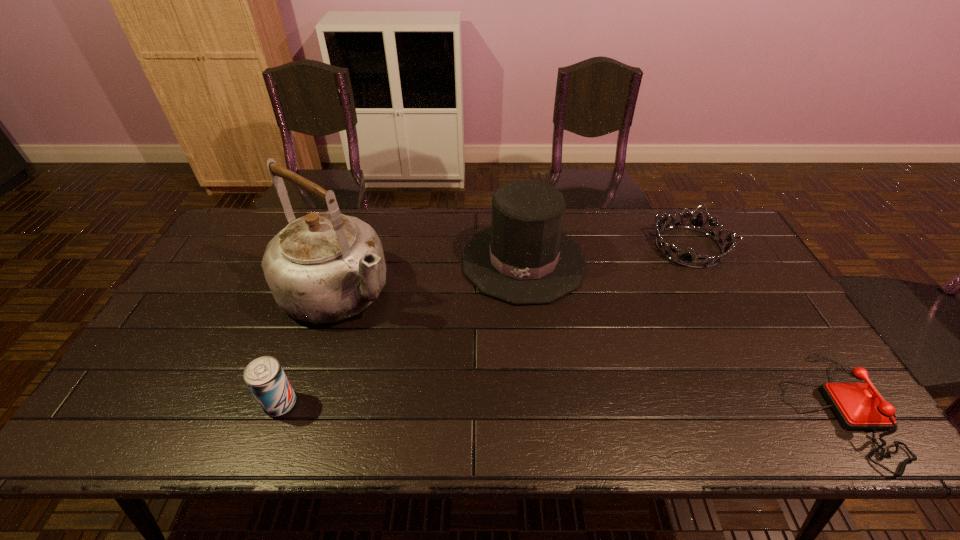
Where is `blank area in the image that satisfies the following two spatial constraints: 1. on the front side of the telephone; 2. on the dial of the beer can`? The width and height of the screenshot is (960, 540). blank area in the image that satisfies the following two spatial constraints: 1. on the front side of the telephone; 2. on the dial of the beer can is located at coordinates (278, 409).

At what (x,y) coordinates should I click in order to perform the action: click on free region that satisfies the following two spatial constraints: 1. on the back side of the tiara; 2. on the right side of the tallest object. Please return your answer as a coordinate pair (x, y). The width and height of the screenshot is (960, 540). Looking at the image, I should click on (354, 247).

Image resolution: width=960 pixels, height=540 pixels. Find the location of `free spot that satisfies the following two spatial constraints: 1. on the back side of the beer can; 2. on the right side of the tiara`. free spot that satisfies the following two spatial constraints: 1. on the back side of the beer can; 2. on the right side of the tiara is located at coordinates (337, 247).